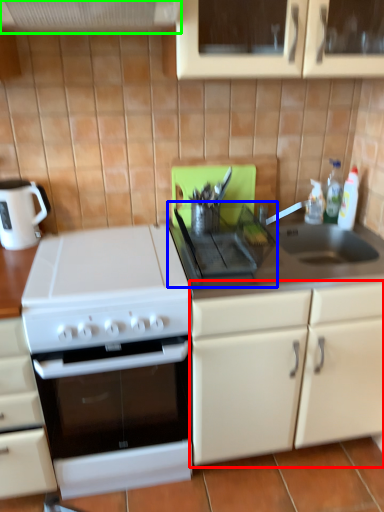
Question: Estimate the real-world distances between objects in this image. Which object is farther from cabinetry (highlighted by a red box), gas stove (highlighted by a blue box) or exhaust hood (highlighted by a green box)?

Choices:
 (A) gas stove
 (B) exhaust hood

Answer: (B)